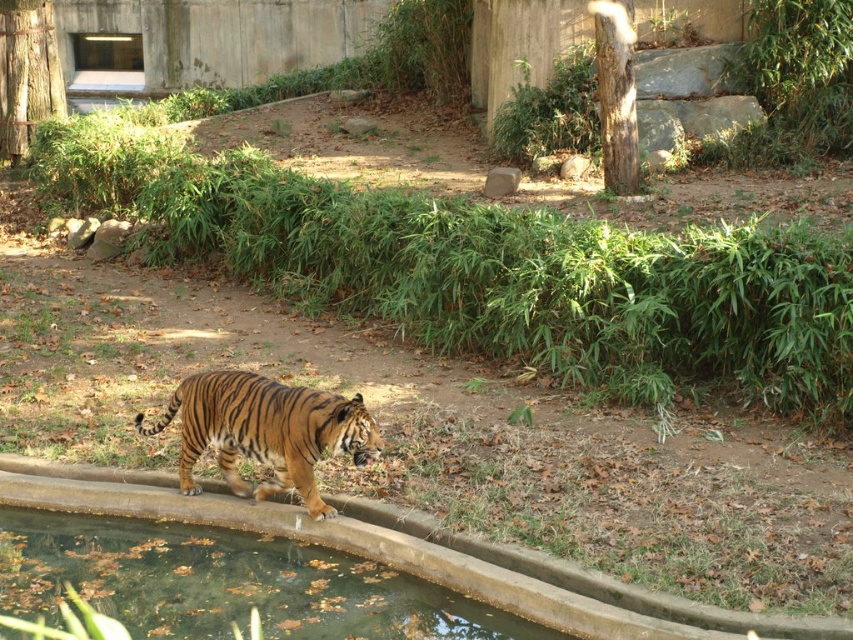
You are a zookeeper who needs to check the water quality of the clear glass puddle at lower left. Where exactly should you look to find it?

A: The clear glass puddle at lower left is located at point coordinates of (227, 582).